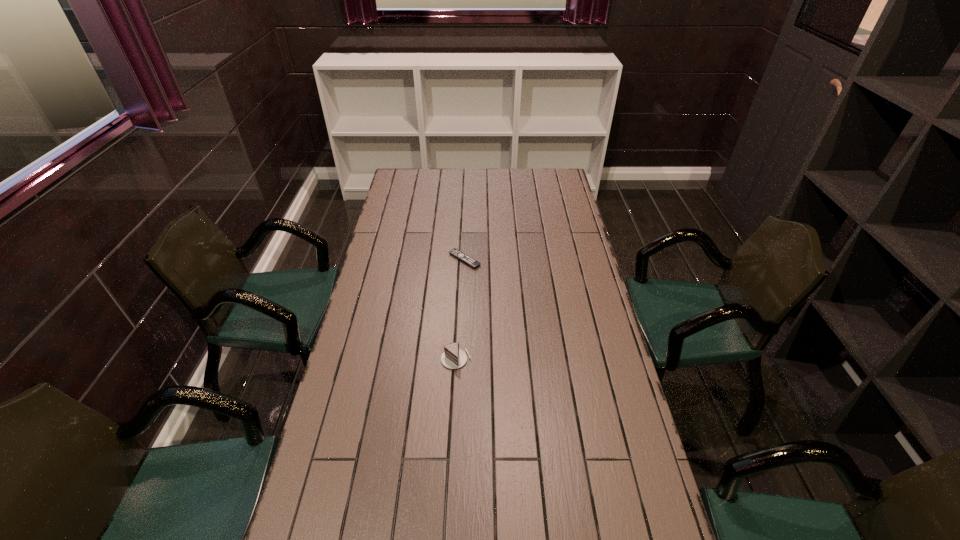
Find the location of a particular element. vacant space at the far right corner of the desktop is located at coordinates (558, 188).

Locate an element on the screen. This screenshot has width=960, height=540. free spot between the farther object and the taller object is located at coordinates (461, 309).

Identify the location of vacant point located between the chocolate cake and the remote control. (461, 309).

The width and height of the screenshot is (960, 540). Identify the location of empty location between the nearer object and the shorter object. tap(461, 309).

The width and height of the screenshot is (960, 540). Find the location of `free space in the image that satisfies the following two spatial constraints: 1. on the back side of the nearer object; 2. on the left side of the shorter object`. free space in the image that satisfies the following two spatial constraints: 1. on the back side of the nearer object; 2. on the left side of the shorter object is located at coordinates (461, 260).

You are a GUI agent. You are given a task and a screenshot of the screen. Output one action in this format:
    pyautogui.click(x=<x>, y=<y>)
    Task: Click on the free space that satisfies the following two spatial constraints: 1. on the back side of the taller object; 2. on the left side of the remote control
    
    Given the screenshot: What is the action you would take?
    pyautogui.click(x=461, y=260)